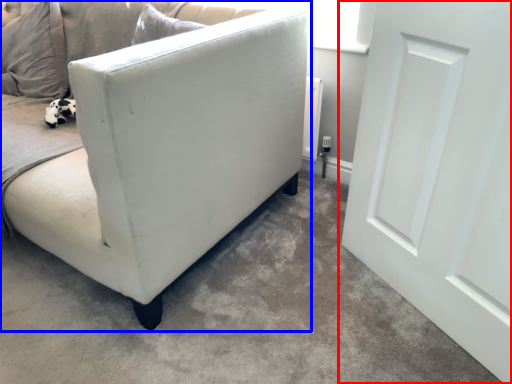
Question: Among these objects, which one is farthest to the camera, door (highlighted by a red box) or studio couch (highlighted by a blue box)?

Choices:
 (A) door
 (B) studio couch

Answer: (B)